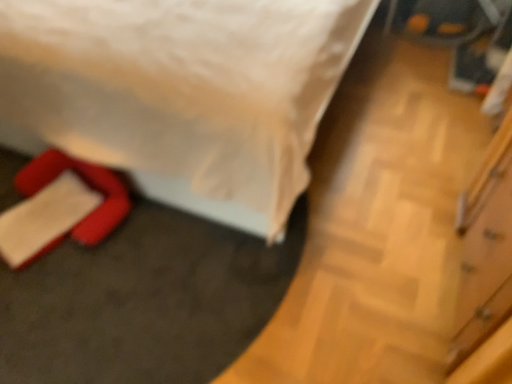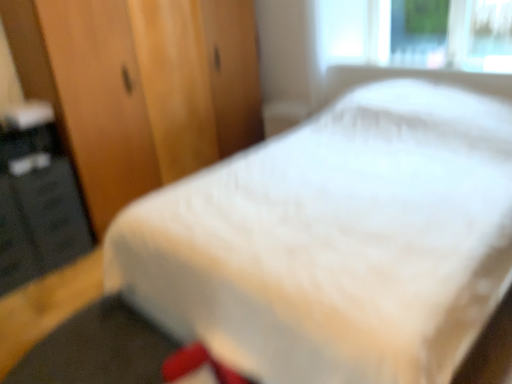
Question: Which way did the camera rotate in the video?

Choices:
 (A) rotated upward
 (B) rotated downward

Answer: (A)